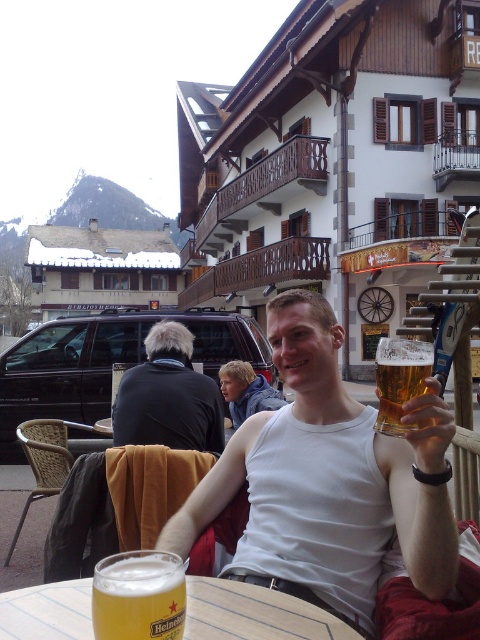
You are standing in the outdoor scene with the man and the table. There are two points marked in the image. Which point is closer to you, point 1 at coordinates (129, 568) or point 2 at coordinates (380, 346)?

Point 1 at coordinates (129, 568) is closer to you than point 2 at coordinates (380, 346).

You are a delivery robot with a 12 inch wide tray. You need to place a new glass between the clear plastic glass at center and the golden glass heineken at lower center. Is there enough space between them to fit your tray?

The clear plastic glass at center and golden glass heineken at lower center are 12.81 inches apart from each other. Since the distance between them is greater than the 12 inch width of your tray, there is enough space to fit your tray between them.